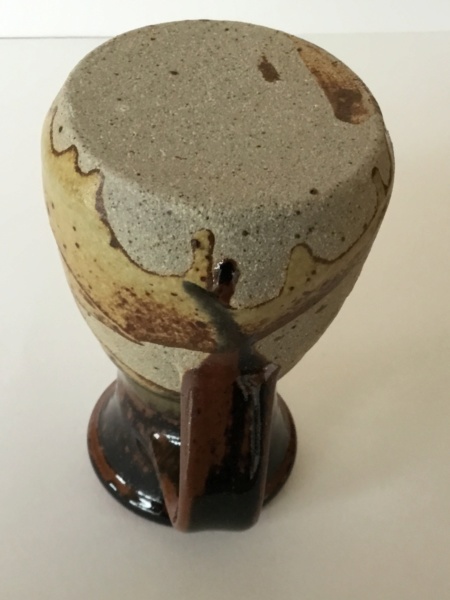
The image size is (450, 600). I want to click on handle, so click(x=226, y=489).